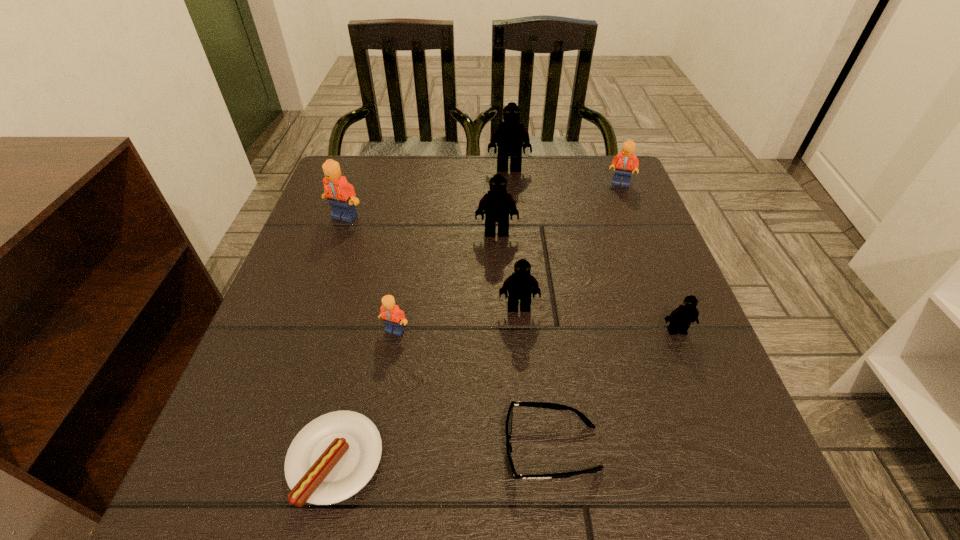
Where is `vacant space located 0.230m on the face of the fifth farthest Lego`? This screenshot has width=960, height=540. vacant space located 0.230m on the face of the fifth farthest Lego is located at coordinates (529, 428).

Locate an element on the screen. Image resolution: width=960 pixels, height=540 pixels. free spot located on the front-facing side of the second Lego from left to right is located at coordinates (383, 402).

The height and width of the screenshot is (540, 960). What are the coordinates of `vacant area situated 0.220m on the face of the nearest black Lego` in the screenshot? It's located at tap(727, 455).

At what (x,y) coordinates should I click in order to perform the action: click on vacant area situated 0.250m on the front-facing side of the sunglasses. Please return your answer as a coordinate pair (x, y). Image resolution: width=960 pixels, height=540 pixels. Looking at the image, I should click on (337, 448).

Where is `free region located 0.360m on the front-facing side of the sunglasses`? This screenshot has height=540, width=960. free region located 0.360m on the front-facing side of the sunglasses is located at coordinates (263, 448).

Where is `vacant area located on the front-facing side of the sunglasses`? This screenshot has height=540, width=960. vacant area located on the front-facing side of the sunglasses is located at coordinates (250, 448).

Identify the location of free spot located on the back of the sausage. (359, 356).

Identify the location of sunglasses positioned at the near edge. (508, 426).

Locate an element on the screen. Image resolution: width=960 pixels, height=540 pixels. sausage positioned at the near edge is located at coordinates (333, 457).

Identify the location of Lego that is at the left edge. This screenshot has height=540, width=960. (341, 195).